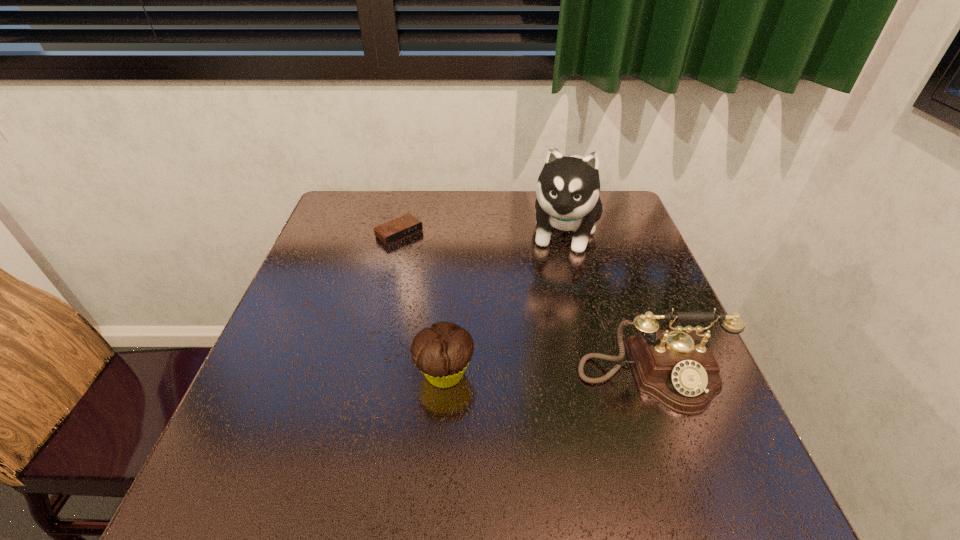
The image size is (960, 540). Identify the location of vacant spot on the desktop that is between the muffin and the telephone and is positioned on the front face of the alarm clock. (568, 375).

Locate an element on the screen. The width and height of the screenshot is (960, 540). free spot on the desktop that is between the muffin and the telephone and is positioned at the face of the puppy is located at coordinates (526, 374).